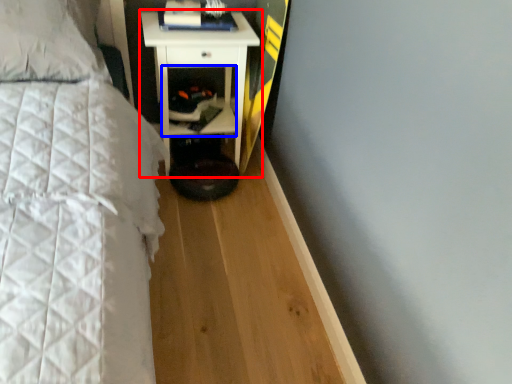
Question: Among these objects, which one is farthest to the camera, nightstand (highlighted by a red box) or cabinet (highlighted by a blue box)?

Choices:
 (A) nightstand
 (B) cabinet

Answer: (B)